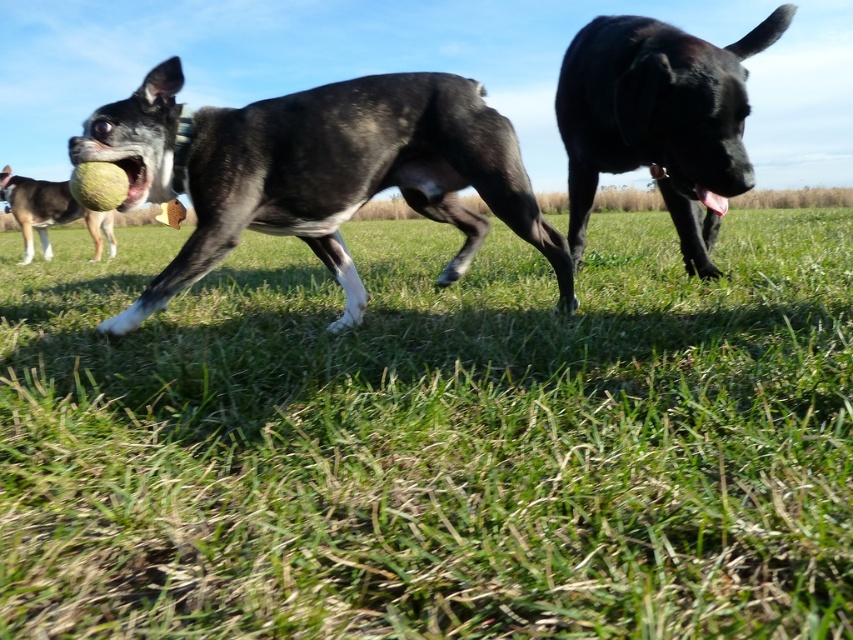
Looking at this image, you are a photographer trying to capture a clear shot of the black matte dog at center and the shiny black tennis ball at center. Which object should you focus on first if you want to ensure both are in focus?

The black matte dog at center is taller than the shiny black tennis ball at center, so you should focus on the black matte dog at center first to ensure both are in focus.

You are a photographer trying to capture the shiny black tennis ball at center in your shot. Based on the scene, where should you position the ball relative to the green grass at center to ensure it is visible?

The green grass at center is located below the shiny black tennis ball at center, so positioning the ball above the green grass at center will ensure it is visible.

Consider the image. You are standing in the field and want to throw a treat to the closest point between point (421, 147) and point (563, 61). Which point should you aim for?

Point (421, 147) is closer to the viewer than point (563, 61), so you should aim for point (421, 147).